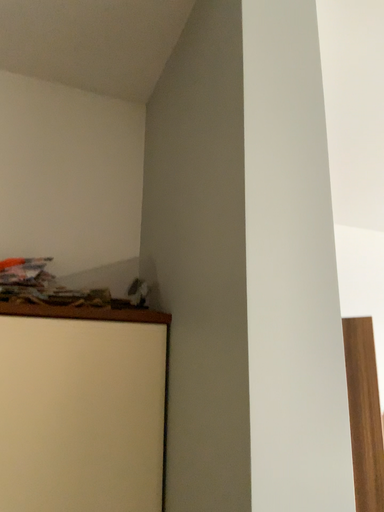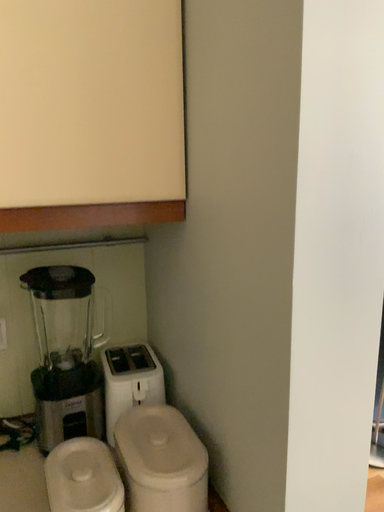
Question: How did the camera likely rotate when shooting the video?

Choices:
 (A) rotated upward
 (B) rotated downward

Answer: (B)